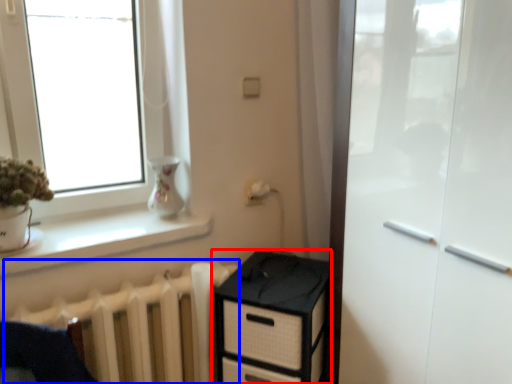
Question: Which point is closer to the camera, chest of drawers (highlighted by a red box) or radiator (highlighted by a blue box)?

Choices:
 (A) chest of drawers
 (B) radiator

Answer: (B)